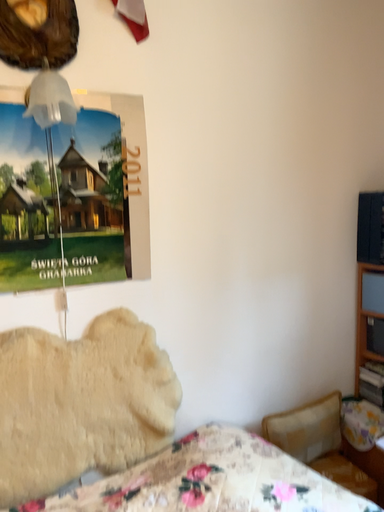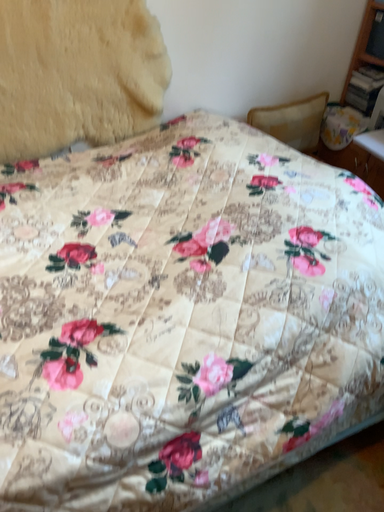
Question: How did the camera likely rotate when shooting the video?

Choices:
 (A) rotated downward
 (B) rotated upward

Answer: (A)